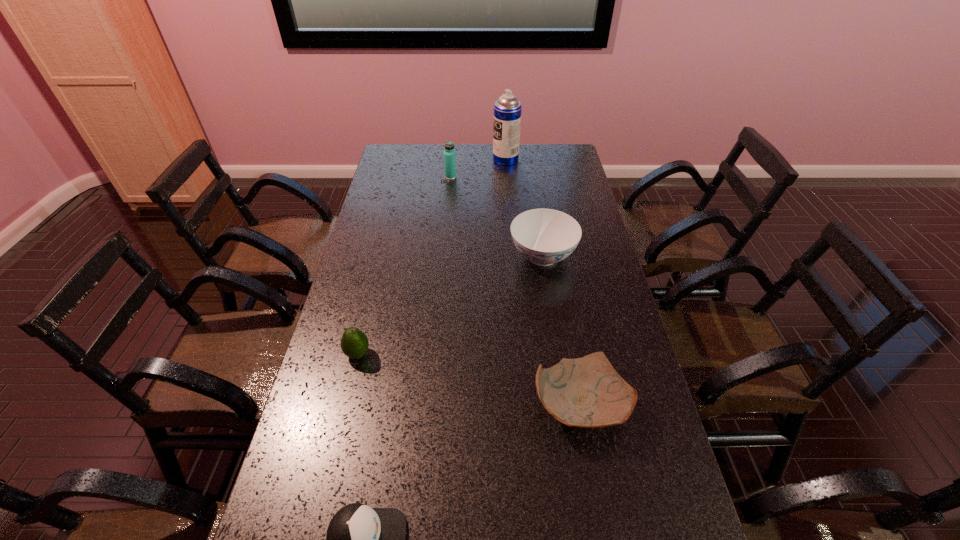
Locate an element on the screen. Image resolution: width=960 pixels, height=540 pixels. free space at the far left corner of the desktop is located at coordinates (418, 159).

Image resolution: width=960 pixels, height=540 pixels. In order to click on vacant region between the fifth farthest object and the avocado in this screenshot , I will do `click(468, 379)`.

The image size is (960, 540). Identify the location of free space between the aerosol can and the chinaware. (524, 208).

Locate an element on the screen. free space between the farthest object and the avocado is located at coordinates (432, 256).

Identify the location of vacant area that lies between the fifth farthest object and the fourth farthest object. (468, 379).

Locate an element on the screen. This screenshot has width=960, height=540. blank region between the third object from left to right and the aerosol can is located at coordinates (478, 168).

Where is `free space between the second nearest object and the third farthest object`? This screenshot has height=540, width=960. free space between the second nearest object and the third farthest object is located at coordinates (562, 330).

Identify the location of object that stands as the third closest to the fourth object from right to left. The height and width of the screenshot is (540, 960). (354, 343).

Identify which object is the nearest to the fifth shortest object. Please provide its 2D coordinates. Your answer should be formatted as a tuple, i.e. [(x, y)], where the tuple contains the x and y coordinates of a point satisfying the conditions above.

[(507, 110)]

I want to click on vacant space that satisfies the following two spatial constraints: 1. on the label side of the fifth farthest object; 2. on the right side of the aerosol can, so click(526, 404).